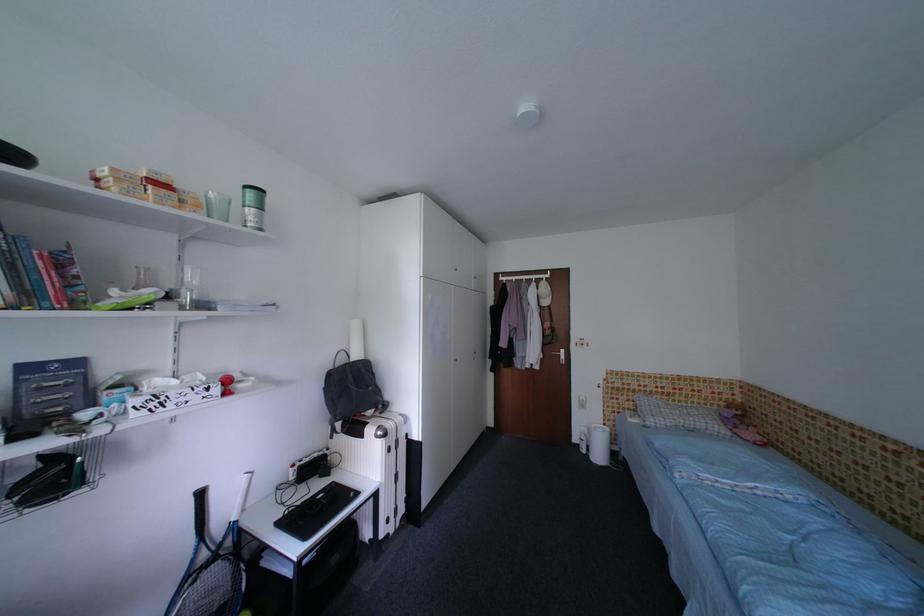
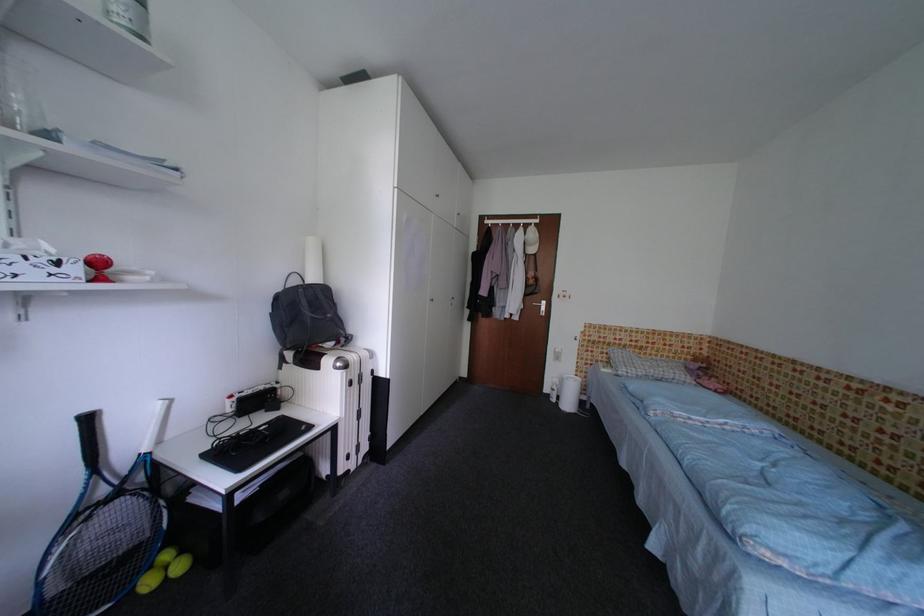
Where in the second image is the point corresponding to pixel 337 378 from the first image?

(286, 301)